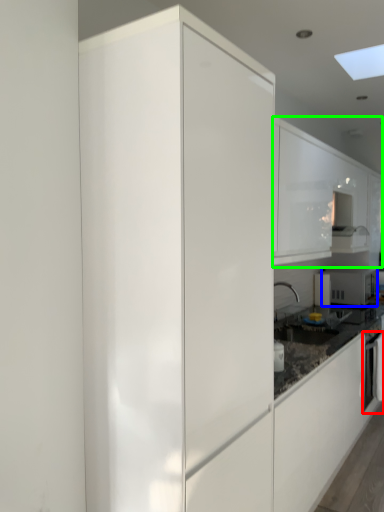
Question: Considering the real-world distances, which object is farthest from oven (highlighted by a red box)? home appliance (highlighted by a blue box) or cabinetry (highlighted by a green box)?

Choices:
 (A) home appliance
 (B) cabinetry

Answer: (B)